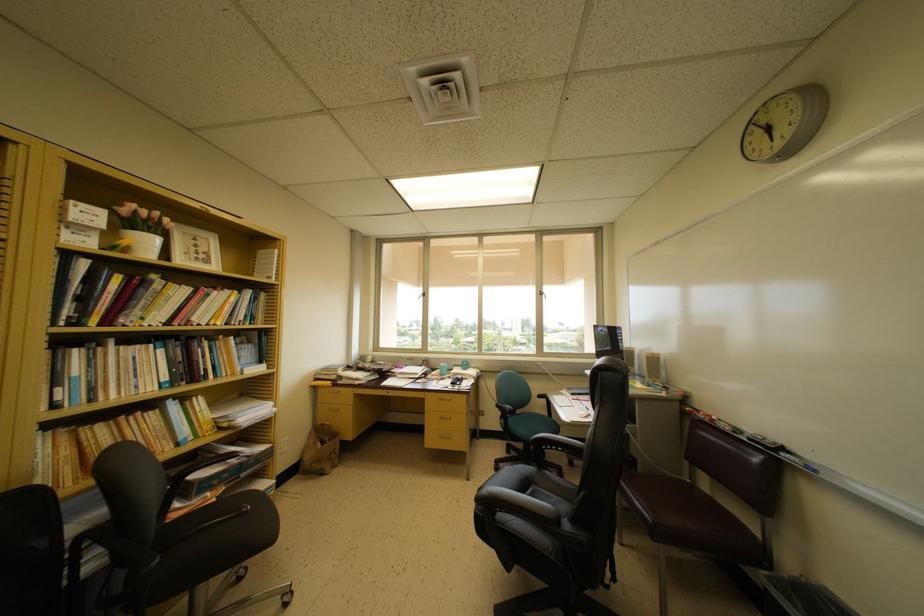
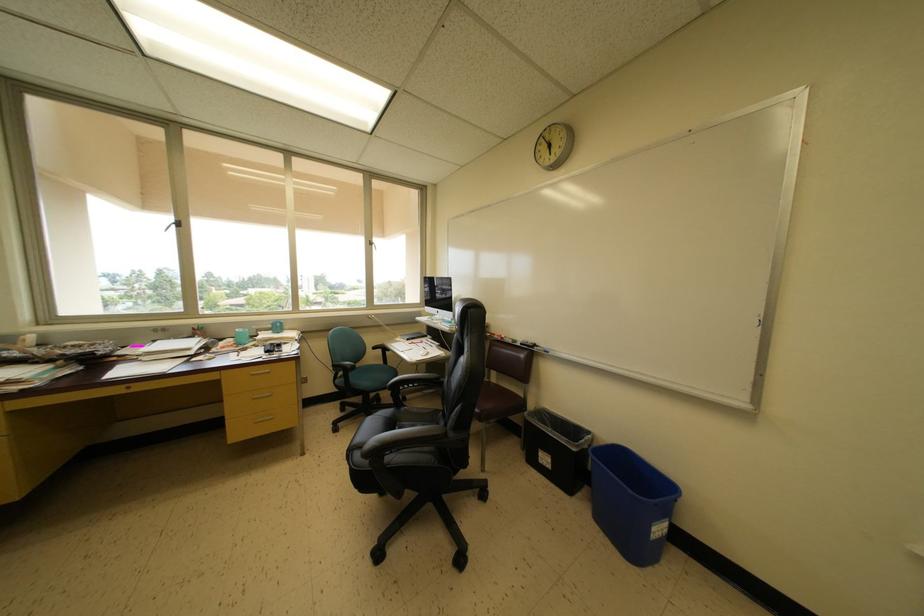
In the second image, find the point that corresponds to (502,411) in the first image.

(338, 371)